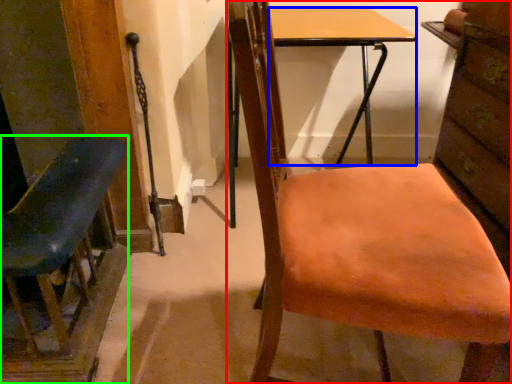
Question: Considering the real-world distances, which object is farthest from chair (highlighted by a red box)? desk (highlighted by a blue box) or chair (highlighted by a green box)?

Choices:
 (A) desk
 (B) chair

Answer: (A)